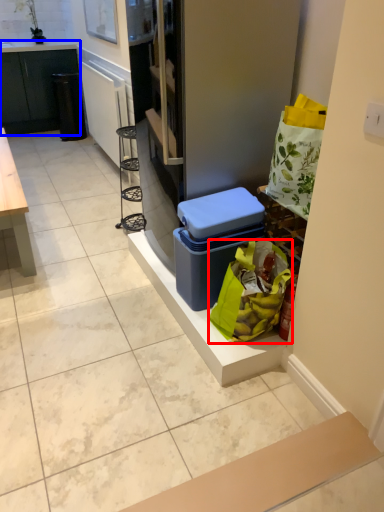
Question: Which point is closer to the camera, shopping bag (highlighted by a red box) or cabinetry (highlighted by a blue box)?

Choices:
 (A) shopping bag
 (B) cabinetry

Answer: (A)